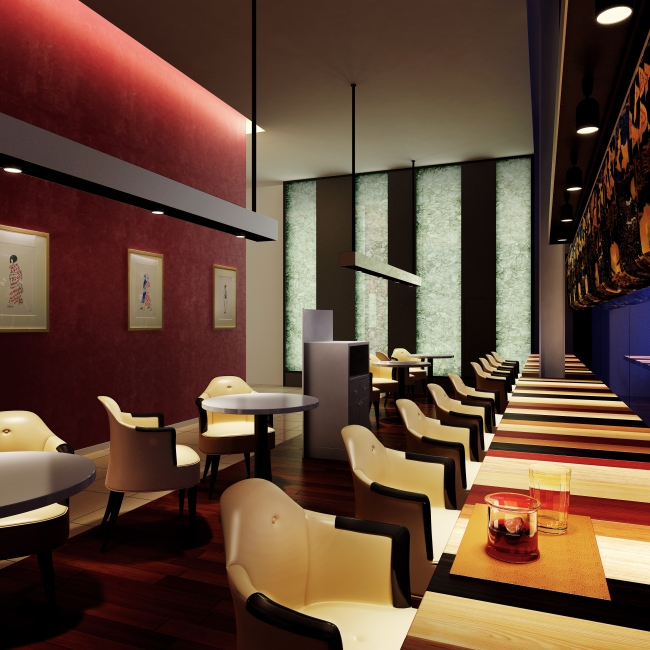
The width and height of the screenshot is (650, 650). What are the coordinates of `ceiling` in the screenshot? It's located at (486, 119).